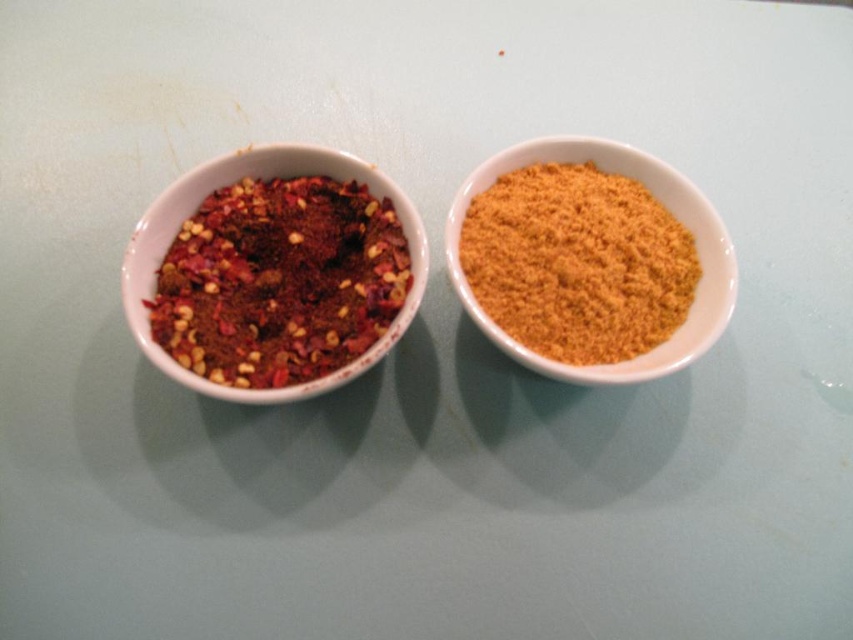
You are a chef preparing a dish that requires you to sprinkle the yellow powder at right over the crumbly red spice mix at left. Based on their positions in the image, which bowl should you pick up first to avoid spilling the contents of the other?

The crumbly red spice mix at left is located below the yellow powder at right, so you should pick up the yellow powder at right first to avoid spilling its contents onto the crumbly red spice mix at left.

You are a chef holding a spoon that is 1 foot long. You want to reach the crumbly red spice mix at left from where you are standing. Can you reach it with your spoon without moving your hand?

The distance of crumbly red spice mix at left from camera is 4.12 feet. Since the spoon is only 1 foot long, you cannot reach the crumbly red spice mix at left without moving your hand.

You are a chef preparing a dish and need to reach both the crumbly red spice mix at left and the yellow powder at right. Which spice container will you need to lean forward more to access?

The crumbly red spice mix at left is closer to the viewer than the yellow powder at right, so you will need to lean forward more to reach the yellow powder at right.